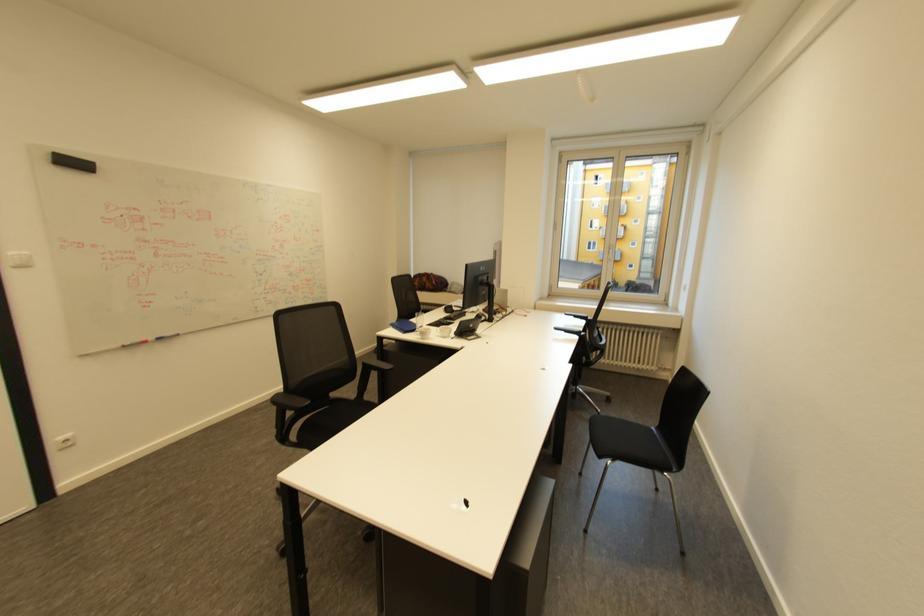
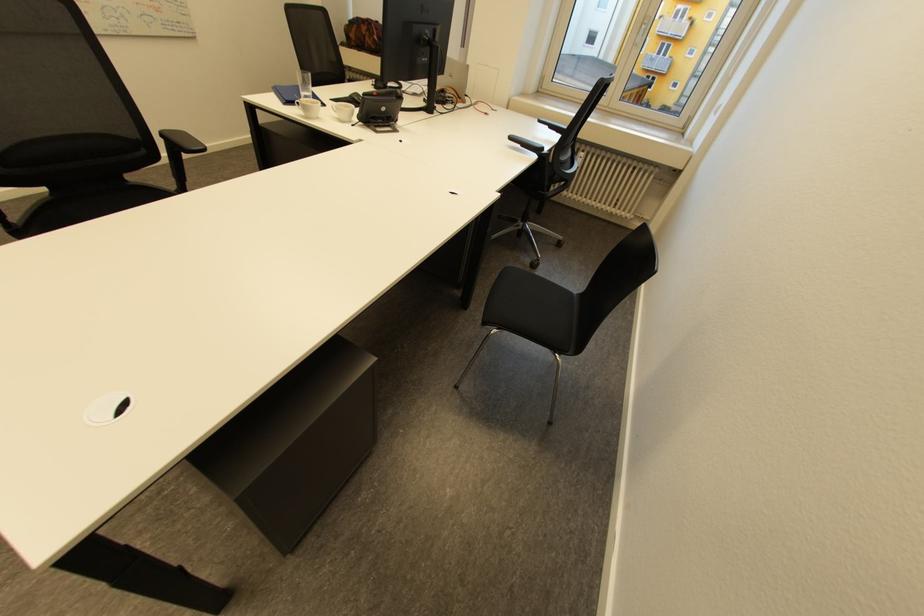
Question: Based on the continuous images, in which direction is the camera rotating? Reply with the corresponding letter.

Choices:
 (A) Left
 (B) Right
 (C) Up
 (D) Down

Answer: (D)